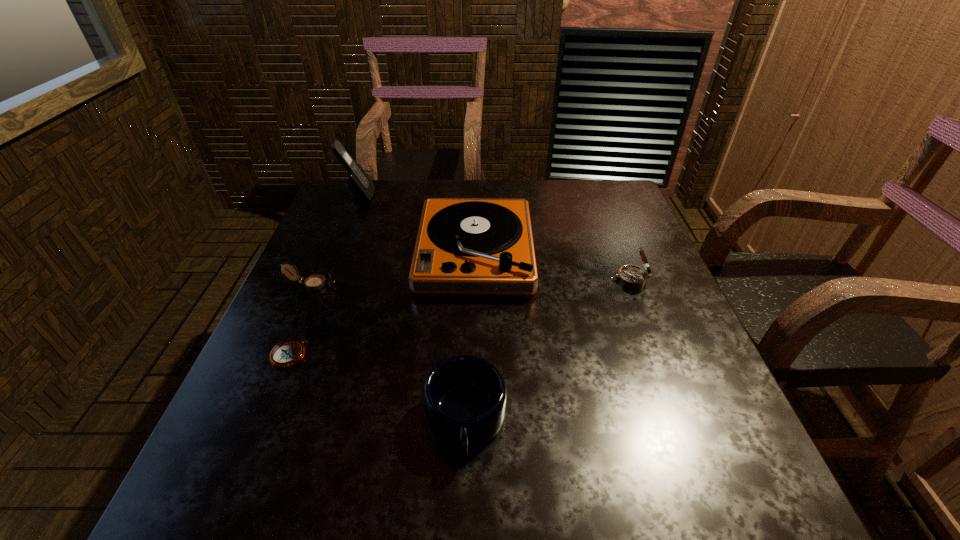
The image size is (960, 540). Find the location of `vacant point that satisfies the following two spatial constraints: 1. with the dial facing the rightmost compass; 2. with the handle on the side of the mug`. vacant point that satisfies the following two spatial constraints: 1. with the dial facing the rightmost compass; 2. with the handle on the side of the mug is located at coordinates (684, 421).

I want to click on free space that satisfies the following two spatial constraints: 1. on the face of the second shortest compass; 2. on the right side of the fifth farthest object, so click(282, 355).

You are a GUI agent. You are given a task and a screenshot of the screen. Output one action in this format:
    pyautogui.click(x=<x>, y=<y>)
    Task: Click on the vacant space that satisfies the following two spatial constraints: 1. on the face of the nearest compass; 2. on the left side of the second tallest compass
    Image resolution: width=960 pixels, height=540 pixels.
    Given the screenshot: What is the action you would take?
    point(282,355)

Find the location of a particular element. free space that satisfies the following two spatial constraints: 1. with the dial facing the tallest compass; 2. on the front side of the shortest compass is located at coordinates (659, 355).

The width and height of the screenshot is (960, 540). Identify the location of vacant point that satisfies the following two spatial constraints: 1. on the front-facing side of the farthest object; 2. on the left side of the record player. (335, 252).

Find the location of a particular element. free spot that satisfies the following two spatial constraints: 1. with the dial facing the rightmost object; 2. with the handle on the side of the mug is located at coordinates (684, 421).